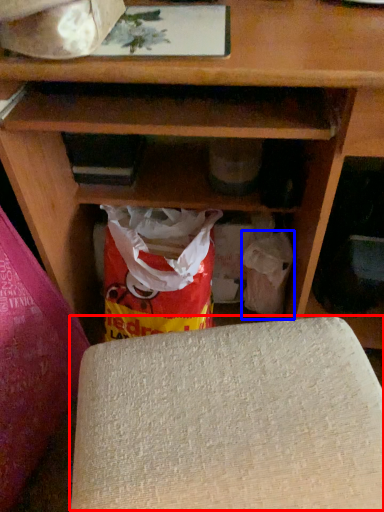
Question: Which of the following is the farthest to the observer, yoga mat (highlighted by a red box) or grocery bag (highlighted by a blue box)?

Choices:
 (A) yoga mat
 (B) grocery bag

Answer: (B)